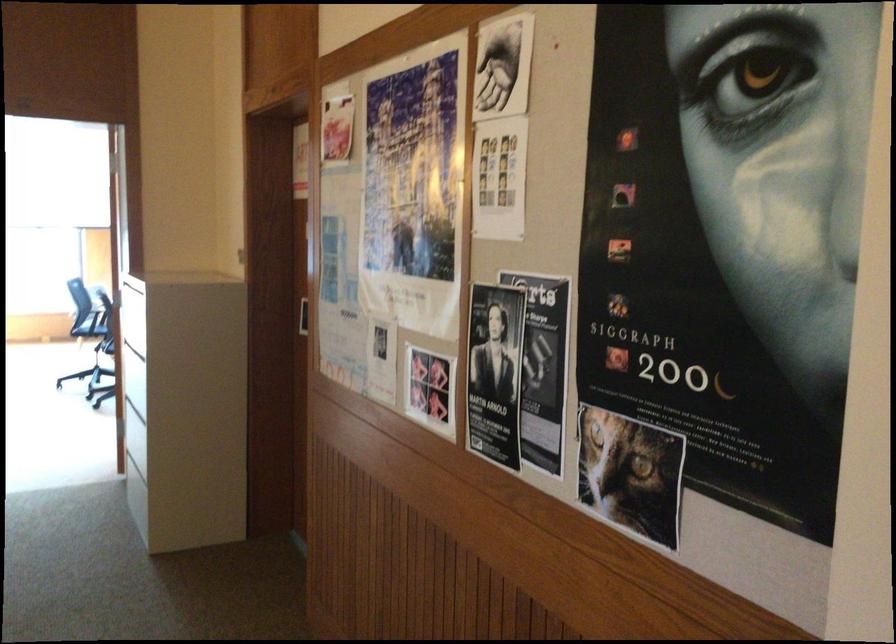
Where is `recessed door handle`? The image size is (896, 644). recessed door handle is located at coordinates (300, 315).